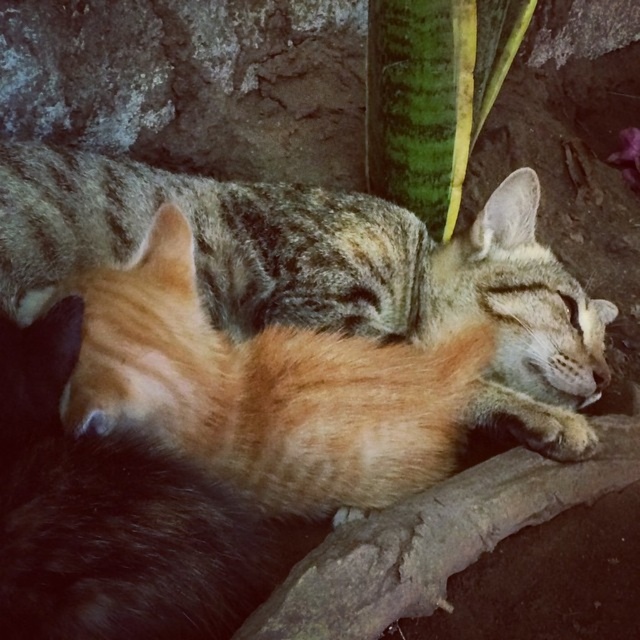
Can you confirm if orange fur cat at center is thinner than green textured leaf at upper center?

In fact, orange fur cat at center might be wider than green textured leaf at upper center.

In the scene shown: Which of these two, orange fur cat at center or green textured leaf at upper center, stands shorter?

green textured leaf at upper center

In the scene shown: Who is more distant from viewer, (x=268, y=244) or (x=396, y=67)?

Point (x=396, y=67)

Image resolution: width=640 pixels, height=640 pixels. I want to click on orange fur cat at center, so click(324, 269).